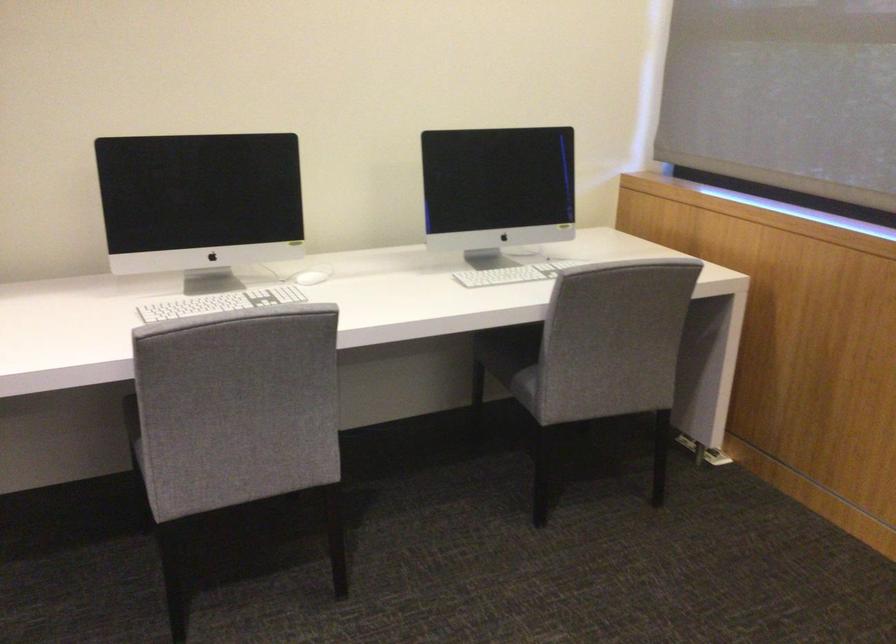
Where would you grip the white computer mouse? Please return your answer as a coordinate pair (x, y).

(307, 277)